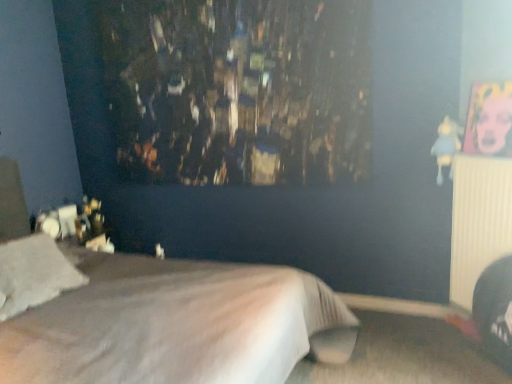
Question: Would you consider blue fabric doll at upper right to be distant from white soft pillow at lower left?

Choices:
 (A) yes
 (B) no

Answer: (A)

Question: Can you confirm if blue fabric doll at upper right is positioned to the right of white soft pillow at lower left?

Choices:
 (A) no
 (B) yes

Answer: (B)

Question: From a real-world perspective, does blue fabric doll at upper right stand above white soft pillow at lower left?

Choices:
 (A) no
 (B) yes

Answer: (B)

Question: Is blue fabric doll at upper right facing away from white soft pillow at lower left?

Choices:
 (A) yes
 (B) no

Answer: (B)

Question: Considering the relative sizes of blue fabric doll at upper right and white soft pillow at lower left in the image provided, is blue fabric doll at upper right bigger than white soft pillow at lower left?

Choices:
 (A) no
 (B) yes

Answer: (A)

Question: From their relative heights in the image, would you say blue fabric doll at upper right is taller or shorter than white ribbed radiator at right?

Choices:
 (A) short
 (B) tall

Answer: (A)

Question: In the image, is blue fabric doll at upper right positioned in front of or behind white ribbed radiator at right?

Choices:
 (A) front
 (B) behind

Answer: (B)

Question: From a real-world perspective, is blue fabric doll at upper right above or below white ribbed radiator at right?

Choices:
 (A) above
 (B) below

Answer: (A)

Question: Looking at their shapes, would you say blue fabric doll at upper right is wider or thinner than white ribbed radiator at right?

Choices:
 (A) thin
 (B) wide

Answer: (B)

Question: In terms of width, does white soft pillow at lower left look wider or thinner when compared to blue fabric doll at upper right?

Choices:
 (A) thin
 (B) wide

Answer: (B)

Question: Is white soft pillow at lower left in front of or behind blue fabric doll at upper right in the image?

Choices:
 (A) behind
 (B) front

Answer: (B)

Question: Choose the correct answer: Is white soft pillow at lower left inside blue fabric doll at upper right or outside it?

Choices:
 (A) outside
 (B) inside

Answer: (A)

Question: Looking at the image, does white soft pillow at lower left seem bigger or smaller compared to blue fabric doll at upper right?

Choices:
 (A) small
 (B) big

Answer: (B)

Question: Is white soft pillow at lower left wider or thinner than white soft bed at center?

Choices:
 (A) thin
 (B) wide

Answer: (A)

Question: From a real-world perspective, relative to white soft bed at center, is white soft pillow at lower left vertically above or below?

Choices:
 (A) below
 (B) above

Answer: (B)